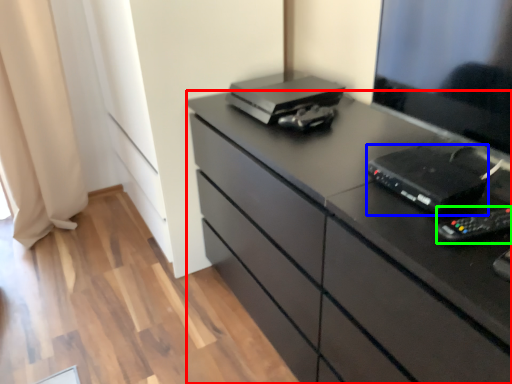
Question: Which object is positioned farthest from chest of drawers (highlighted by a red box)? Select from equipment (highlighted by a blue box) and equipment (highlighted by a green box).

Choices:
 (A) equipment
 (B) equipment

Answer: (B)